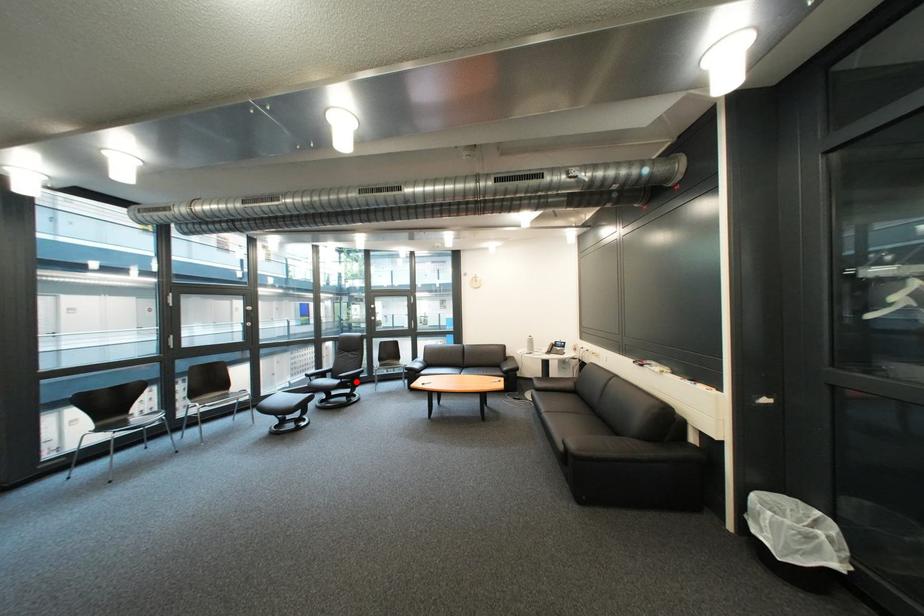
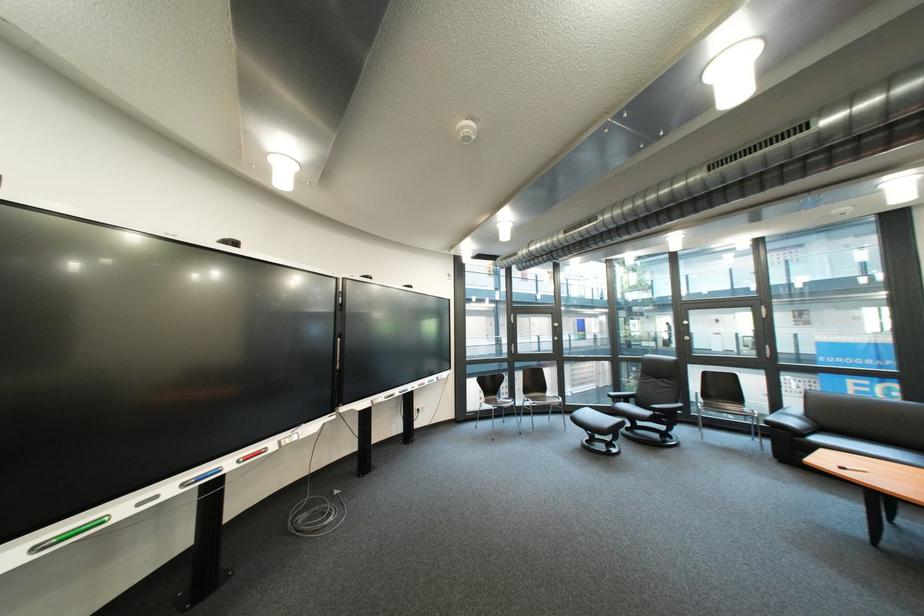
Question: I am providing you with two images of the same scene from different viewpoints. Image1 has a red point marked. In image2, the corresponding 3D location appears at what relative position? Reply with the corresponding letter.

Choices:
 (A) Closer
 (B) Farther

Answer: (A)